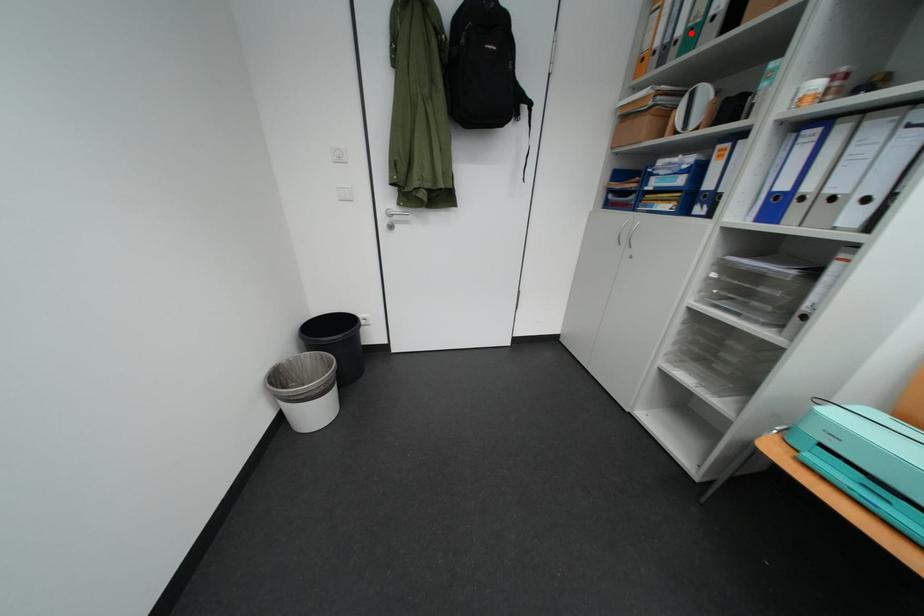
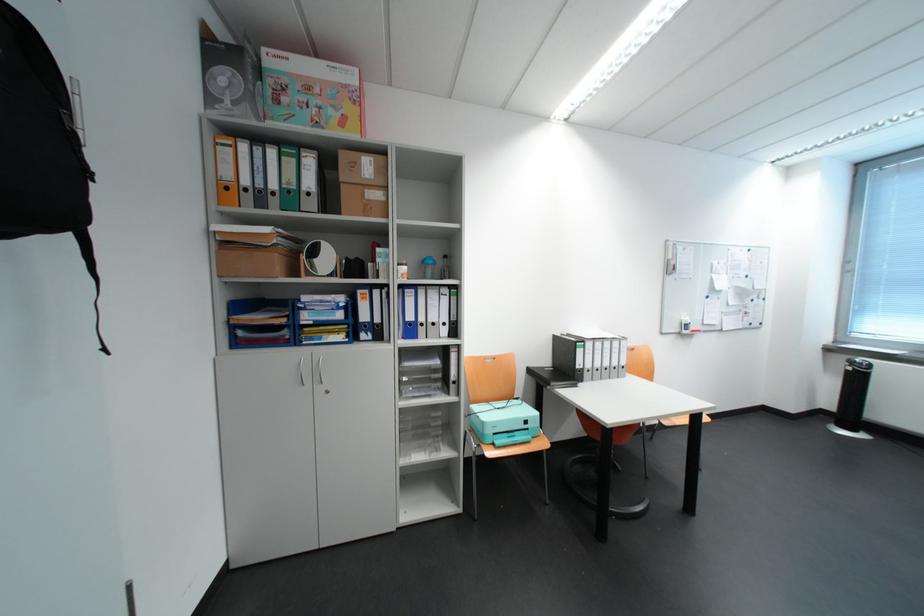
The point at the highlighted location is marked in the first image. Where is the corresponding point in the second image?

(285, 188)